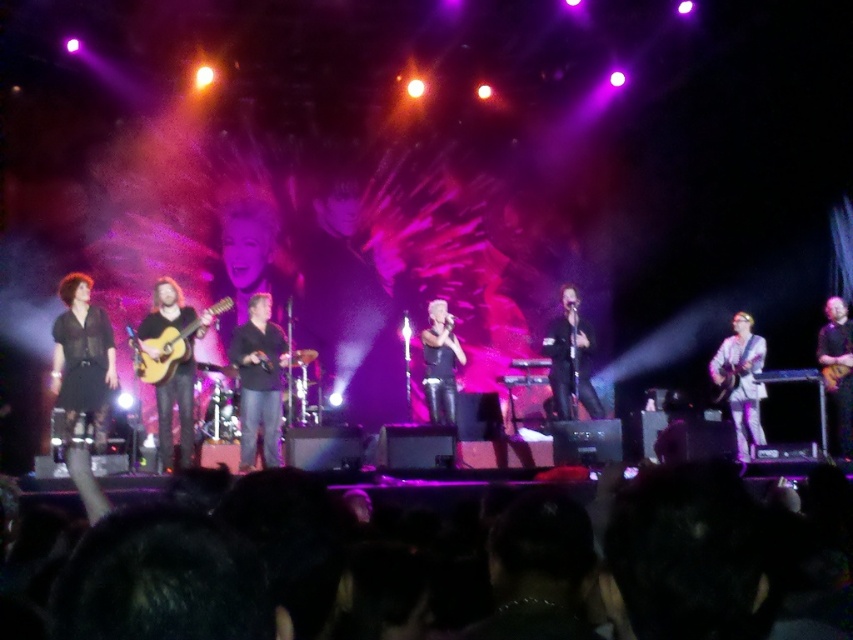
Is black matte shirt at left below black matte microphone at center?

Yes, black matte shirt at left is below black matte microphone at center.

I want to click on black matte shirt at left, so click(x=82, y=358).

Does point (84, 320) come in front of point (578, 333)?

Yes, point (84, 320) is in front of point (578, 333).

The height and width of the screenshot is (640, 853). I want to click on black matte shirt at left, so click(82, 358).

Between point (102, 401) and point (851, 365), which one is positioned in front?

Positioned in front is point (102, 401).

Between black matte shirt at left and black leather guitar at right, which one appears on the left side from the viewer's perspective?

From the viewer's perspective, black matte shirt at left appears more on the left side.

Which is in front, point (103, 314) or point (844, 356)?

Positioned in front is point (103, 314).

Where is `black matte shirt at left`? The height and width of the screenshot is (640, 853). black matte shirt at left is located at coordinates (82, 358).

Who is higher up, black matte shirt at center or white glossy guitar at right?

black matte shirt at center is above.

Measure the distance between point (270, 323) and camera.

Point (270, 323) is 7.78 meters from camera.

Is point (270, 440) in front of point (746, 396)?

Yes.

The height and width of the screenshot is (640, 853). In order to click on black matte shirt at center in this screenshot , I will do `click(258, 380)`.